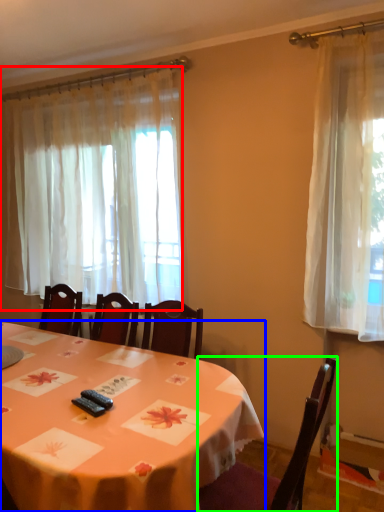
Question: Which object is positioned closest to curtain (highlighted by a red box)? Select from table (highlighted by a blue box) and chair (highlighted by a green box).

Choices:
 (A) table
 (B) chair

Answer: (A)